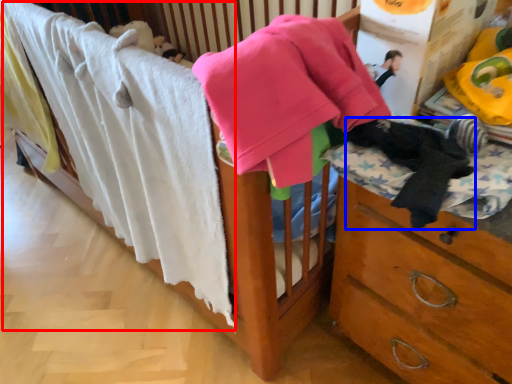
Question: Among these objects, which one is nearest to the camera, bath towel (highlighted by a red box) or clothing (highlighted by a blue box)?

Choices:
 (A) bath towel
 (B) clothing

Answer: (B)